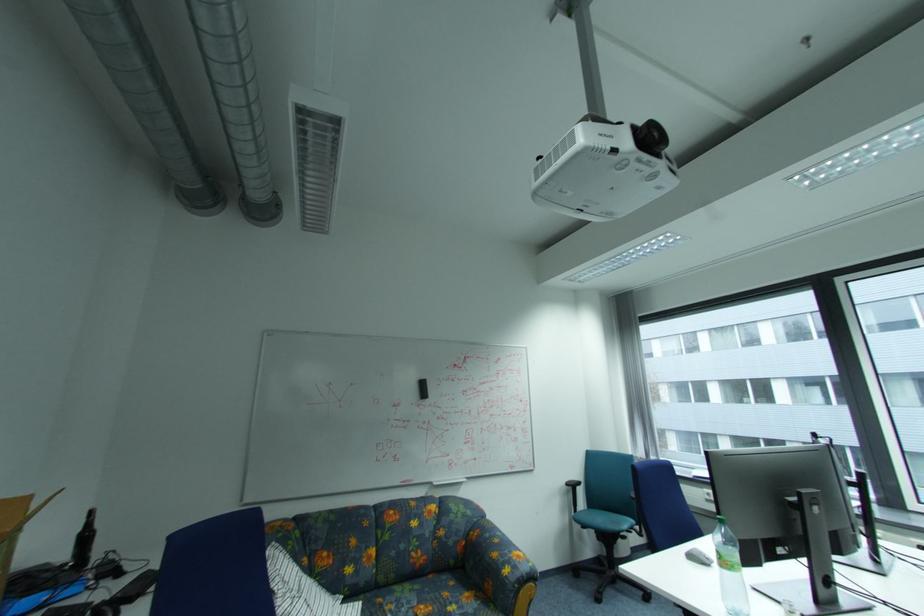
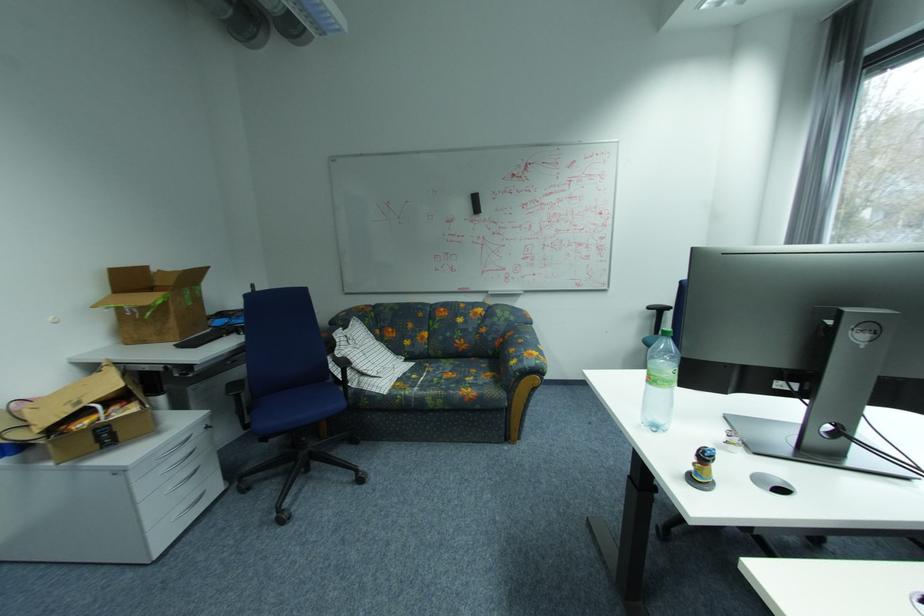
The point at (423, 391) is marked in the first image. Where is the corresponding point in the second image?

(476, 206)